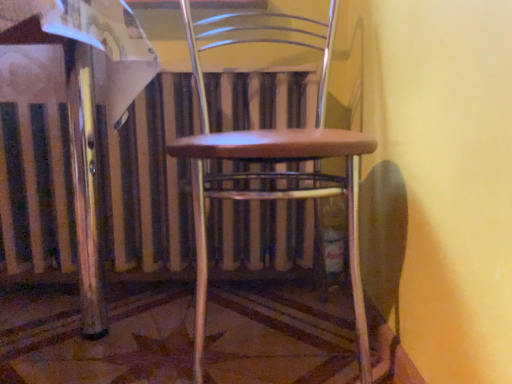
Question: Is metallic silver radiator at center a part of wooden seat at center?

Choices:
 (A) yes
 (B) no

Answer: (B)

Question: From the image's perspective, would you say wooden seat at center is positioned over metallic silver radiator at center?

Choices:
 (A) yes
 (B) no

Answer: (A)

Question: Can we say wooden seat at center lies outside metallic silver radiator at center?

Choices:
 (A) no
 (B) yes

Answer: (B)

Question: Could you tell me if wooden seat at center is turned towards metallic silver radiator at center?

Choices:
 (A) no
 (B) yes

Answer: (A)

Question: Is metallic silver radiator at center at the back of wooden seat at center?

Choices:
 (A) yes
 (B) no

Answer: (A)

Question: Is wooden seat at center wider than metallic silver radiator at center?

Choices:
 (A) no
 (B) yes

Answer: (B)

Question: From a real-world perspective, is metallic silver radiator at center physically below wooden seat at center?

Choices:
 (A) no
 (B) yes

Answer: (B)

Question: Can we say metallic silver radiator at center lies outside wooden seat at center?

Choices:
 (A) no
 (B) yes

Answer: (B)

Question: From a real-world perspective, does metallic silver radiator at center stand above wooden seat at center?

Choices:
 (A) no
 (B) yes

Answer: (A)

Question: From the image's perspective, does metallic silver radiator at center appear lower than wooden seat at center?

Choices:
 (A) no
 (B) yes

Answer: (B)

Question: Are metallic silver radiator at center and wooden seat at center far apart?

Choices:
 (A) no
 (B) yes

Answer: (A)

Question: Can you confirm if metallic silver radiator at center is smaller than wooden seat at center?

Choices:
 (A) no
 (B) yes

Answer: (B)

Question: In terms of size, does wooden seat at center appear bigger or smaller than metallic silver radiator at center?

Choices:
 (A) small
 (B) big

Answer: (B)